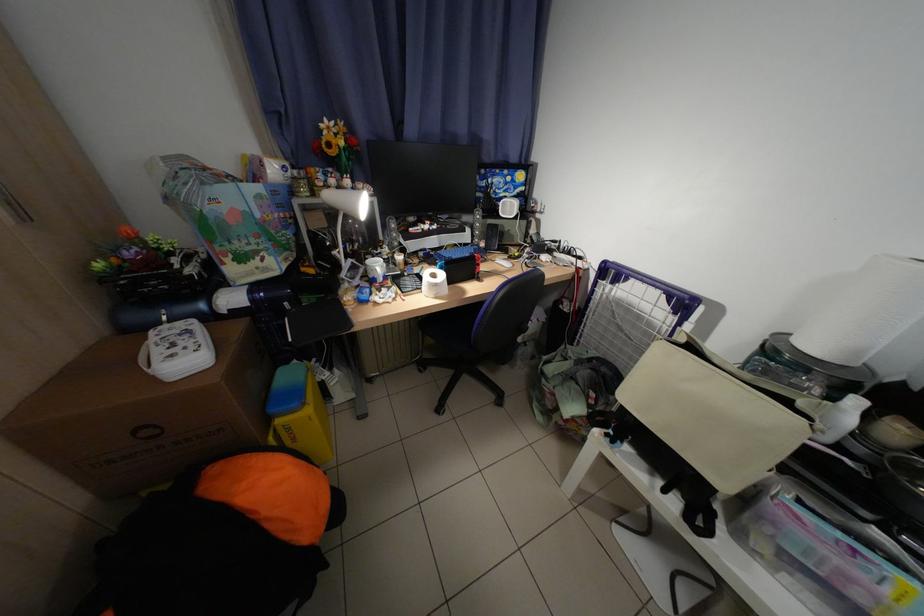
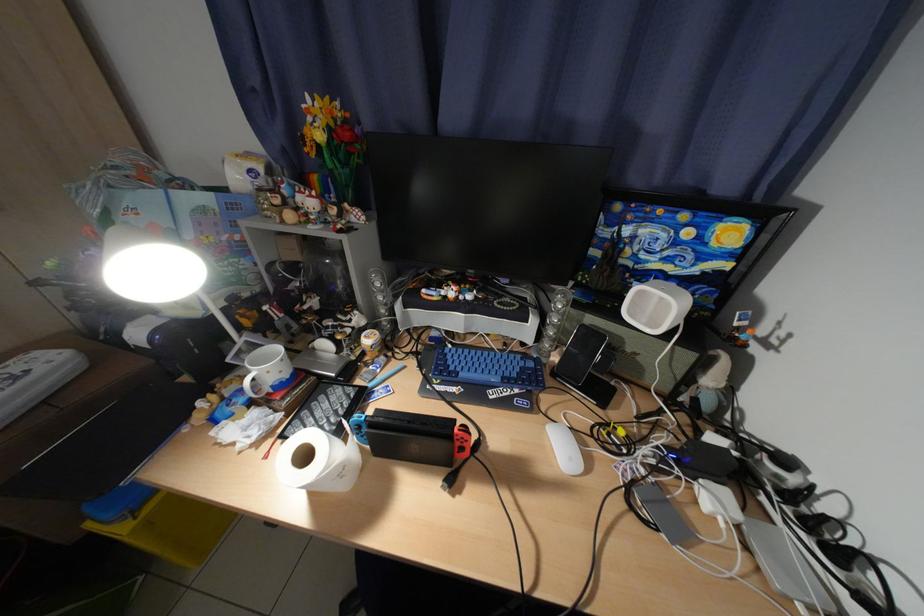
Question: The camera is either moving clockwise (left) or counter-clockwise (right) around the object. The first image is from the beginning of the video and the second image is from the end. Is the camera moving left or right when shooting the video?

Choices:
 (A) Left
 (B) Right

Answer: (B)